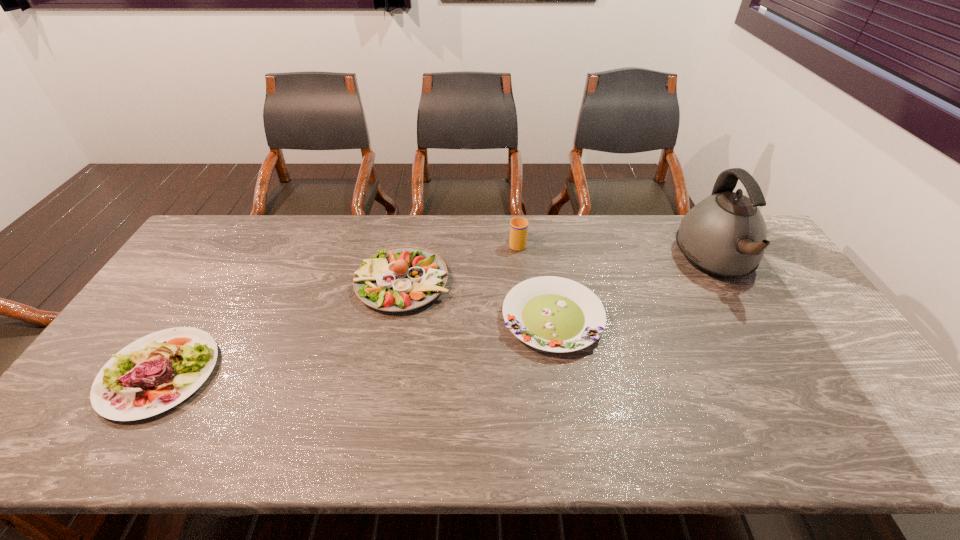
I want to click on the rightmost object, so click(724, 236).

Locate an element on the screen. the tallest object is located at coordinates (724, 236).

I want to click on cup, so click(x=518, y=226).

Identify the location of the tallest salad plate. (399, 279).

Where is `the fourth object from right to left`? the fourth object from right to left is located at coordinates (399, 279).

This screenshot has width=960, height=540. Find the location of `the second shortest object`. the second shortest object is located at coordinates (129, 386).

Where is `the leftmost salad plate`? the leftmost salad plate is located at coordinates (129, 386).

At what (x,y) coordinates should I click in order to perform the action: click on the shortest salad plate. Please return your answer as a coordinate pair (x, y). Looking at the image, I should click on (554, 314).

Locate an element on the screen. the rightmost salad plate is located at coordinates (554, 314).

In order to click on vacant space located at the spout of the rightmost object in this screenshot , I will do `click(811, 423)`.